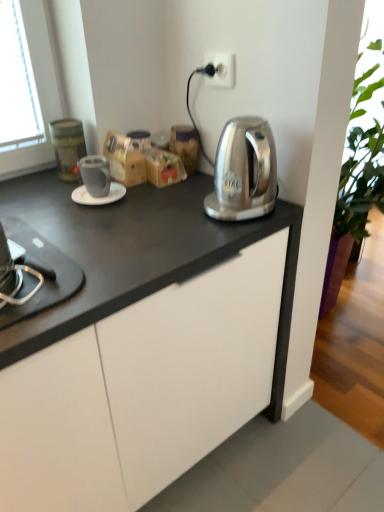
This screenshot has width=384, height=512. Identify the location of free spot to the right of black glass stovetop at lower left. tap(98, 271).